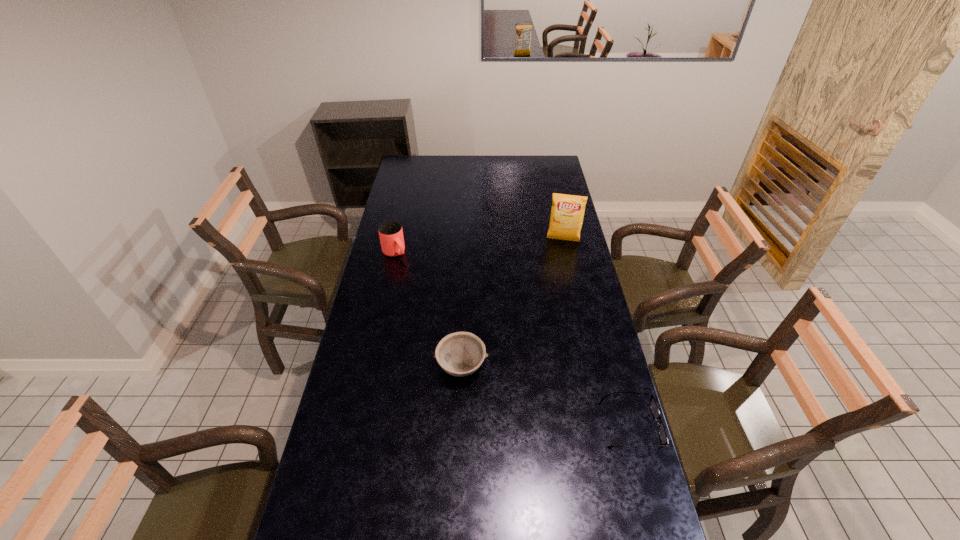
Where is `free space on the desktop that is between the third tallest object and the shortest object and is positioned on the front of the tallest object with the logo`? The height and width of the screenshot is (540, 960). free space on the desktop that is between the third tallest object and the shortest object and is positioned on the front of the tallest object with the logo is located at coordinates (546, 396).

You are a GUI agent. You are given a task and a screenshot of the screen. Output one action in this format:
    pyautogui.click(x=<x>, y=<y>)
    Task: Click on the free spot on the desktop that is between the third object from right to left and the nearest object and is positioned on the handle side of the cup
    Image resolution: width=960 pixels, height=540 pixels.
    Given the screenshot: What is the action you would take?
    pyautogui.click(x=519, y=386)